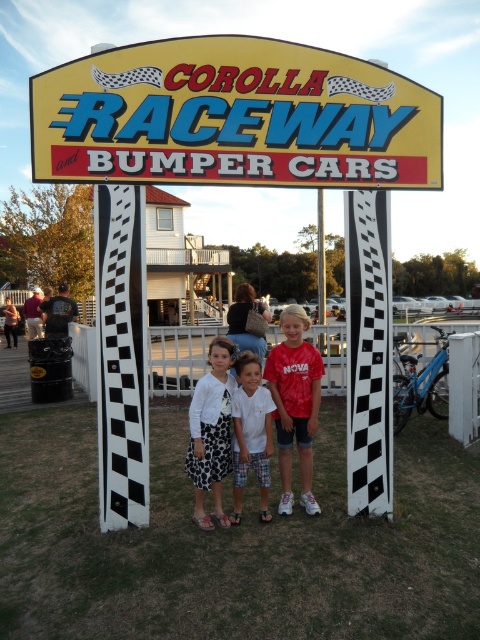
Does yellow plastic sign at upper center lie in front of white cotton shirt at center?

Yes, it is.

Does yellow plastic sign at upper center have a larger size compared to white cotton shirt at center?

Yes.

What do you see at coordinates (233, 116) in the screenshot?
I see `yellow plastic sign at upper center` at bounding box center [233, 116].

Find the location of a particular element. yellow plastic sign at upper center is located at coordinates (233, 116).

Based on the photo, is yellow plastic sign at upper center taller than red tie-dye shirt at center?

Indeed, yellow plastic sign at upper center has a greater height compared to red tie-dye shirt at center.

Can you confirm if yellow plastic sign at upper center is smaller than red tie-dye shirt at center?

Actually, yellow plastic sign at upper center might be larger than red tie-dye shirt at center.

Is point (273, 116) less distant than point (294, 396)?

Yes, it is in front of point (294, 396).

Where is `yellow plastic sign at upper center`? yellow plastic sign at upper center is located at coordinates (233, 116).

Locate an element on the screen. The height and width of the screenshot is (640, 480). red tie-dye shirt at center is located at coordinates (295, 403).

Does red tie-dye shirt at center appear on the right side of white textured sweater at center?

Indeed, red tie-dye shirt at center is positioned on the right side of white textured sweater at center.

Is point (297, 355) farther from viewer compared to point (207, 451)?

Yes, it is.

The image size is (480, 640). Identify the location of red tie-dye shirt at center. (295, 403).